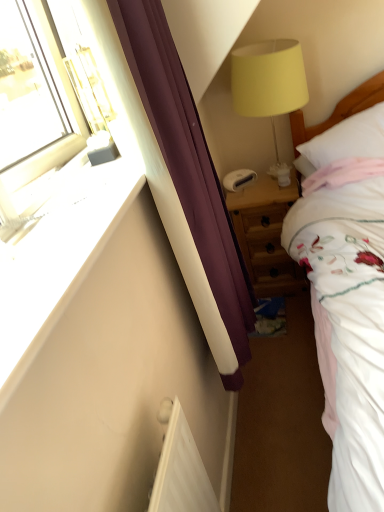
Describe the element at coordinates (266, 234) in the screenshot. This screenshot has width=384, height=512. I see `wooden nightstand at center` at that location.

At what (x,y) coordinates should I click in order to perform the action: click on white soft pillow at right. Please return your answer as a coordinate pair (x, y). Looking at the image, I should click on (345, 141).

At what (x,y) coordinates should I click in order to perform the action: click on yellow fabric lampshade at upper right. Please return your answer as a coordinate pair (x, y). Looking at the image, I should click on (269, 83).

Can you tell me how much white soft pillow at right and yellow fabric lampshade at upper right differ in facing direction?

The angular difference between white soft pillow at right and yellow fabric lampshade at upper right is 10 degrees.

Locate an element on the screen. table lamp that is above the white soft pillow at right (from a real-world perspective) is located at coordinates [269, 83].

Looking at this image, is white soft pillow at right inside the boundaries of yellow fabric lampshade at upper right, or outside?

white soft pillow at right cannot be found inside yellow fabric lampshade at upper right.

Based on the photo, considering the relative sizes of wooden nightstand at center and white smooth wall at left in the image provided, is wooden nightstand at center bigger than white smooth wall at left?

Correct, wooden nightstand at center is larger in size than white smooth wall at left.

From the image's perspective, is wooden nightstand at center located beneath white smooth wall at left?

Incorrect, from the image's perspective, wooden nightstand at center is higher than white smooth wall at left.

Is wooden nightstand at center looking in the opposite direction of white smooth wall at left?

No, white smooth wall at left is not at the back of wooden nightstand at center.

Does wooden nightstand at center appear on the right side of white smooth wall at left?

Yes, wooden nightstand at center is to the right of white smooth wall at left.

Considering the sizes of objects yellow fabric lampshade at upper right and white smooth wall at left in the image provided, who is smaller, yellow fabric lampshade at upper right or white smooth wall at left?

Smaller between the two is white smooth wall at left.

What's the angular difference between yellow fabric lampshade at upper right and white smooth wall at left's facing directions?

88 degrees separate the facing orientations of yellow fabric lampshade at upper right and white smooth wall at left.

Between yellow fabric lampshade at upper right and white smooth wall at left, which one is positioned behind?

yellow fabric lampshade at upper right is more distant.

Which is more to the left, white smooth wall at left or wooden nightstand at center?

From the viewer's perspective, white smooth wall at left appears more on the left side.

How far apart are white smooth wall at left and wooden nightstand at center?

A distance of 1.27 meters exists between white smooth wall at left and wooden nightstand at center.

From the image's perspective, is white smooth wall at left over wooden nightstand at center?

No, from the image's perspective, white smooth wall at left is not above wooden nightstand at center.

Considering the sizes of objects white smooth wall at left and wooden nightstand at center in the image provided, who is bigger, white smooth wall at left or wooden nightstand at center?

wooden nightstand at center is bigger.

Does wooden nightstand at center have a lesser height compared to yellow fabric lampshade at upper right?

Yes.

Considering the points (235, 209) and (262, 64), which point is in front, point (235, 209) or point (262, 64)?

Positioned in front is point (262, 64).

From the image's perspective, who appears lower, wooden nightstand at center or yellow fabric lampshade at upper right?

From the image's view, wooden nightstand at center is below.

Considering the sizes of objects white soft pillow at right and wooden nightstand at center in the image provided, who is wider, white soft pillow at right or wooden nightstand at center?

white soft pillow at right.

From the image's perspective, is white soft pillow at right located beneath wooden nightstand at center?

Incorrect, from the image's perspective, white soft pillow at right is higher than wooden nightstand at center.

Is white soft pillow at right far away from wooden nightstand at center?

That's not correct — white soft pillow at right is a little close to wooden nightstand at center.

The width and height of the screenshot is (384, 512). Identify the location of pillow that is in front of the wooden nightstand at center. (345, 141).

Between yellow fabric lampshade at upper right and white soft pillow at right, which one appears on the right side from the viewer's perspective?

Positioned to the right is white soft pillow at right.

From the image's perspective, between yellow fabric lampshade at upper right and white soft pillow at right, who is located below?

white soft pillow at right.

Are yellow fabric lampshade at upper right and white soft pillow at right far apart?

They are positioned close to each other.

Is yellow fabric lampshade at upper right outside of white soft pillow at right?

Yes, yellow fabric lampshade at upper right is located beyond the bounds of white soft pillow at right.

The image size is (384, 512). I want to click on pillow in front of the yellow fabric lampshade at upper right, so click(345, 141).

At what (x,y) coordinates should I click in order to perform the action: click on window sill below the wooden nightstand at center (from the image's perspective). Please return your answer as a coordinate pair (x, y). Looking at the image, I should click on (55, 270).

Considering their positions, is white smooth wall at left positioned further to white soft pillow at right than purple fabric curtain at left?

Among the two, white smooth wall at left is located further to white soft pillow at right.

Looking at the image, which one is located further to white smooth wall at left, yellow fabric lampshade at upper right or wooden nightstand at center?

wooden nightstand at center.

When comparing their distances from yellow fabric lampshade at upper right, does purple fabric curtain at left or white soft pillow at right seem closer?

white soft pillow at right is closer to yellow fabric lampshade at upper right.

Considering their positions, is white smooth wall at left positioned further to white soft pillow at right than wooden nightstand at center?

white smooth wall at left is positioned further to the anchor white soft pillow at right.

When comparing their distances from purple fabric curtain at left, does white soft pillow at right or white smooth wall at left seem closer?

Among the two, white smooth wall at left is located nearer to purple fabric curtain at left.

Considering their positions, is yellow fabric lampshade at upper right positioned further to white soft pillow at right than white smooth wall at left?

Based on the image, white smooth wall at left appears to be further to white soft pillow at right.

Based on their spatial positions, is white soft pillow at right or wooden nightstand at center further from yellow fabric lampshade at upper right?

The object further to yellow fabric lampshade at upper right is wooden nightstand at center.

Estimate the real-world distances between objects in this image. Which object is further from purple fabric curtain at left, yellow fabric lampshade at upper right or wooden nightstand at center?

yellow fabric lampshade at upper right is further to purple fabric curtain at left.

Where is `pillow between white smooth wall at left and yellow fabric lampshade at upper right along the z-axis`? pillow between white smooth wall at left and yellow fabric lampshade at upper right along the z-axis is located at coordinates 345,141.

Where is `pillow between purple fabric curtain at left and yellow fabric lampshade at upper right in the front-back direction`? The image size is (384, 512). pillow between purple fabric curtain at left and yellow fabric lampshade at upper right in the front-back direction is located at coordinates (345, 141).

Identify the location of curtain between white smooth wall at left and white soft pillow at right in the front-back direction. (188, 165).

At what (x,y) coordinates should I click in order to perform the action: click on table lamp between purple fabric curtain at left and wooden nightstand at center in the front-back direction. Please return your answer as a coordinate pair (x, y). The height and width of the screenshot is (512, 384). Looking at the image, I should click on (269, 83).